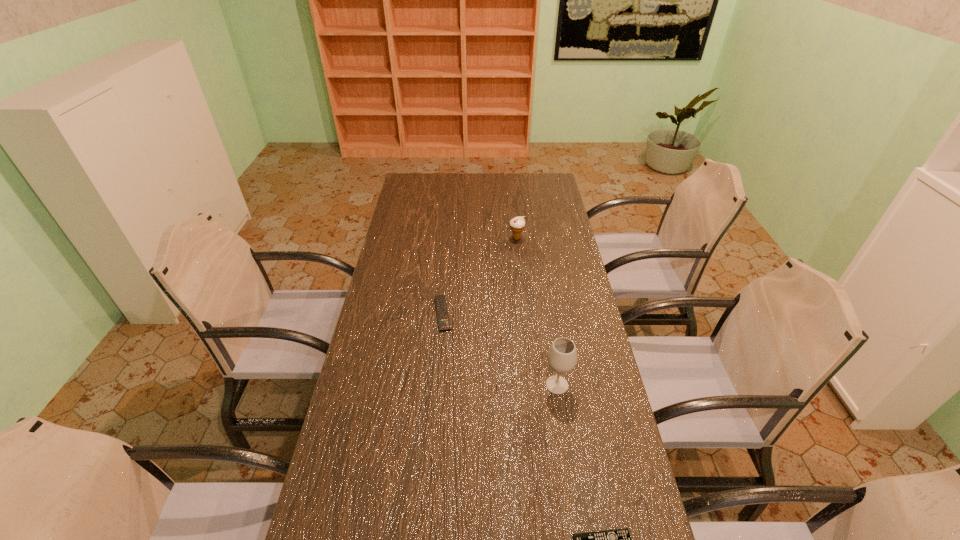
Where is `the tallest object`? This screenshot has height=540, width=960. the tallest object is located at coordinates (562, 356).

Where is `wineglass`? This screenshot has height=540, width=960. wineglass is located at coordinates tap(562, 356).

This screenshot has height=540, width=960. I want to click on the second tallest object, so click(x=517, y=224).

Find the location of a particular element. icecream is located at coordinates (517, 224).

Locate an element on the screen. This screenshot has height=540, width=960. the farther remote control is located at coordinates (440, 300).

This screenshot has height=540, width=960. I want to click on the second farthest object, so click(440, 300).

Identify the location of vacant space located on the back of the wineglass. The width and height of the screenshot is (960, 540). (546, 319).

Locate an element on the screen. The height and width of the screenshot is (540, 960). free space located 0.070m on the back of the third shortest object is located at coordinates (516, 225).

What are the coordinates of `vacant region located 0.330m on the right of the farther remote control` in the screenshot? It's located at (546, 313).

At what (x,y) coordinates should I click in order to perform the action: click on object that is at the right edge. Please return your answer as a coordinate pair (x, y). Looking at the image, I should click on (562, 356).